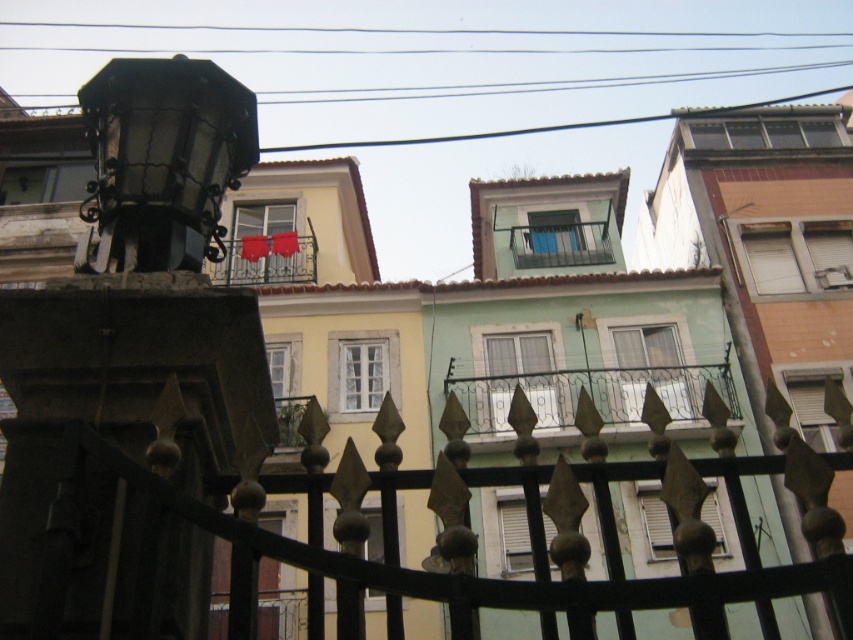
Can you confirm if black wrought iron fence at center is wider than metallic gray balcony at center?

Incorrect, black wrought iron fence at center's width does not surpass metallic gray balcony at center's.

Is black wrought iron fence at center taller than metallic gray balcony at center?

Incorrect, black wrought iron fence at center's height is not larger of metallic gray balcony at center's.

Is point (30, 556) positioned after point (576, 262)?

No, (30, 556) is in front of (576, 262).

Find the location of `black wrought iron fence at center`. black wrought iron fence at center is located at coordinates pyautogui.click(x=317, y=529).

Find the location of a particular element. The image size is (853, 640). metallic gray balcony at center is located at coordinates (558, 241).

Who is taller, metallic gray balcony at center or metallic balcony at center?

metallic balcony at center is taller.

Where is `metallic gray balcony at center`? The height and width of the screenshot is (640, 853). metallic gray balcony at center is located at coordinates tap(558, 241).

Which is below, black wrought iron fence at center or green wrought iron balcony at center?

green wrought iron balcony at center

Is black wrought iron fence at center smaller than green wrought iron balcony at center?

Yes, black wrought iron fence at center is smaller than green wrought iron balcony at center.

Find the location of a particular element. black wrought iron fence at center is located at coordinates (317, 529).